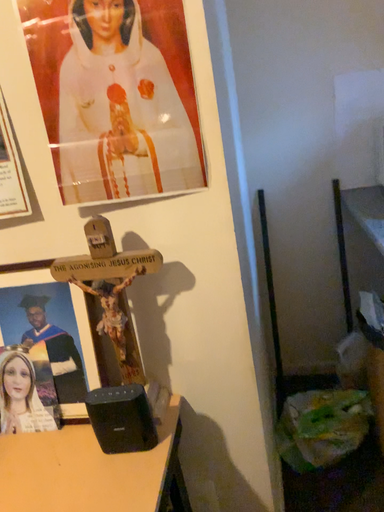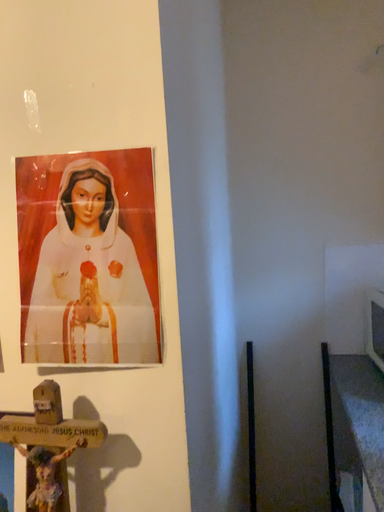
Question: How did the camera likely rotate when shooting the video?

Choices:
 (A) rotated upward
 (B) rotated downward

Answer: (A)